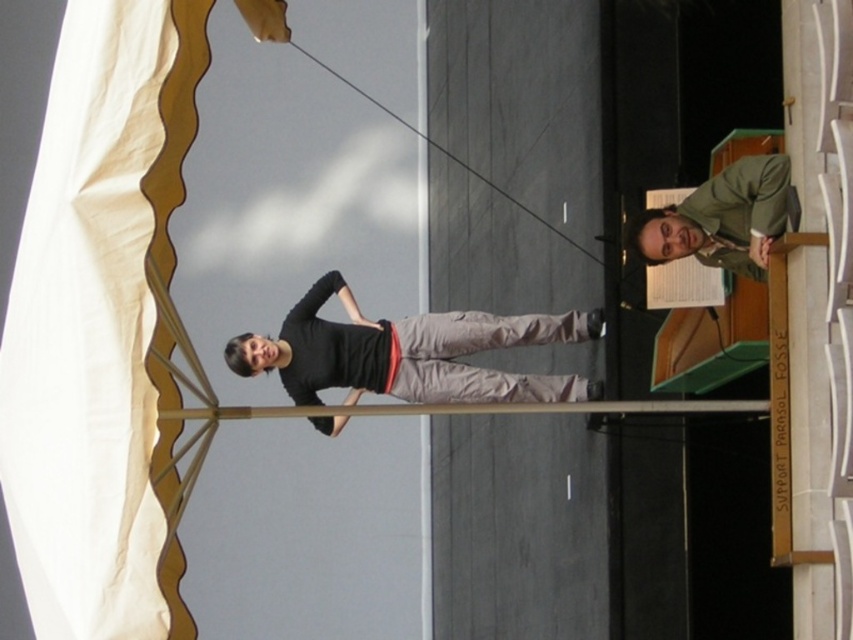
Question: Is black matte shirt at center wider than green matte jacket at upper right?

Choices:
 (A) yes
 (B) no

Answer: (A)

Question: Which point is farther from the camera taking this photo?

Choices:
 (A) (780, 156)
 (B) (364, 376)

Answer: (B)

Question: Which point is farther to the camera?

Choices:
 (A) black matte shirt at center
 (B) green matte jacket at upper right

Answer: (A)

Question: Can you confirm if black matte shirt at center is positioned above green matte jacket at upper right?

Choices:
 (A) no
 (B) yes

Answer: (A)

Question: Is black matte shirt at center thinner than green matte jacket at upper right?

Choices:
 (A) yes
 (B) no

Answer: (B)